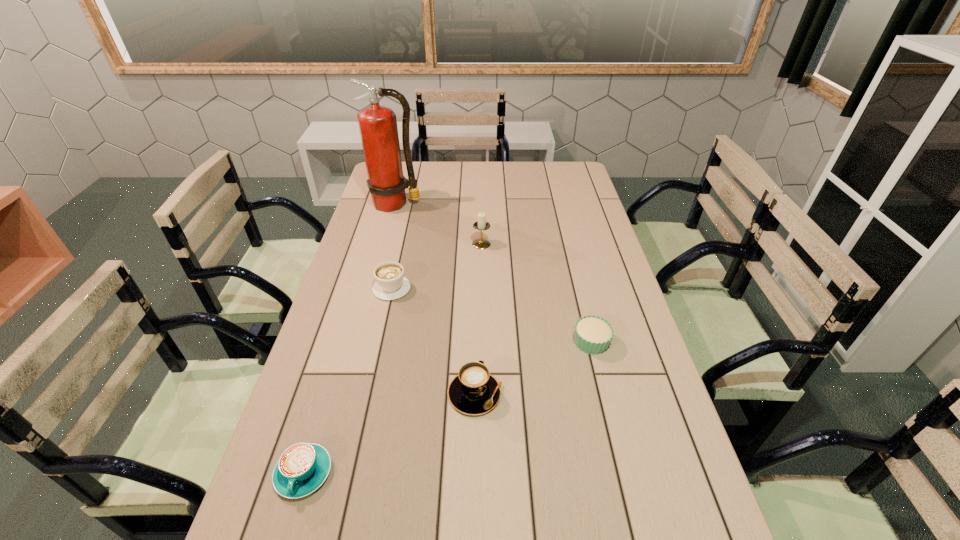
Identify the location of the tallest object. This screenshot has width=960, height=540. (378, 127).

The height and width of the screenshot is (540, 960). Find the location of `fire extinguisher`. fire extinguisher is located at coordinates (378, 127).

At what (x,y) coordinates should I click in order to perform the action: click on candle holder. Please return your answer as a coordinate pair (x, y). Image resolution: width=960 pixels, height=540 pixels. Looking at the image, I should click on (480, 243).

At what (x,y) coordinates should I click in order to perform the action: click on the second farthest object. Please return your answer as a coordinate pair (x, y). Looking at the image, I should click on (480, 243).

Where is `the second farthest cappuccino`? the second farthest cappuccino is located at coordinates (474, 391).

The image size is (960, 540). Find the location of `the second nearest object`. the second nearest object is located at coordinates (474, 391).

Locate an element on the screen. the farthest cappuccino is located at coordinates (390, 284).

This screenshot has width=960, height=540. Identify the location of cupcake. (593, 334).

Image resolution: width=960 pixels, height=540 pixels. Identify the location of the fourth farthest object. (593, 334).

The height and width of the screenshot is (540, 960). Find the location of `the shortest cappuccino`. the shortest cappuccino is located at coordinates 302,468.